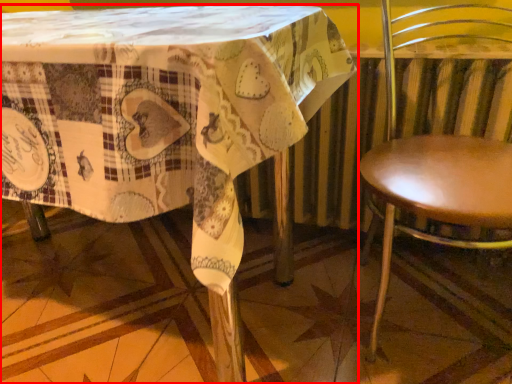
Question: From the image, what is the correct spatial relationship of table (annotated by the red box) in relation to chair?

Choices:
 (A) right
 (B) left

Answer: (B)